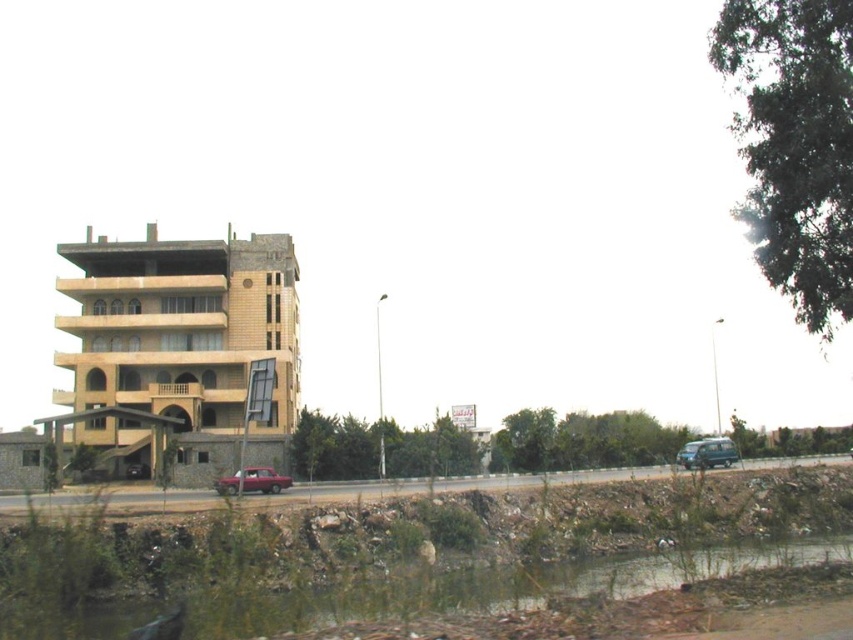
You are a delivery person trying to park your vehicle in this area. You see the brown dirt at lower left and the metallic blue van at lower right. Which location would be better for parking your vehicle?

The metallic blue van at lower right is a better parking spot because the brown dirt at lower left is above it, indicating the van is on lower ground which might be more stable and accessible.

You are standing in front of the construction site and want to locate two specific points marked on the ground. The first point is at coordinate point(55,636) and the second is at point(726,445). Which point is closer to you?

Point(55,636) is closer to the viewer than point(726,445).

Based on the photo, you are standing at the point labeled as point (503, 586) in the image. Based on the scene described, what would you most likely find under your feet?

The point labeled as point (503, 586) corresponds to brown dirt at lower left, so you would most likely find brown dirt under your feet.